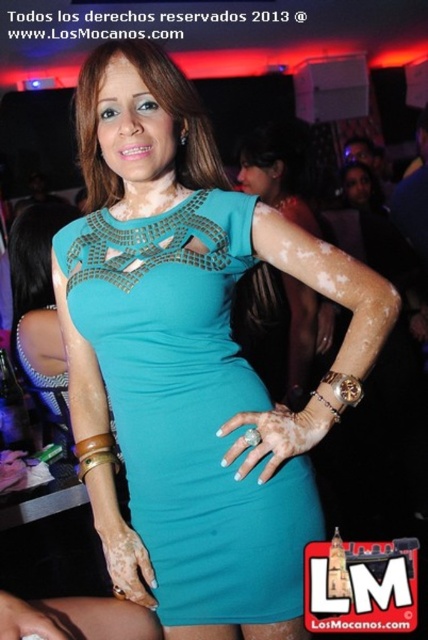
Where is the teal jersey dress at center located in the image?

The teal jersey dress at center is located at point 0.639 on the x axis and 0.444 on the y axis.

You are a photographer at a party and need to capture a clear shot of the woman in the teal jersey dress at center and the teal fabric dress at center. Which dress will appear larger in the photo?

The teal jersey dress at center will appear larger in the photo because it is closer to the viewer than the teal fabric dress at center.